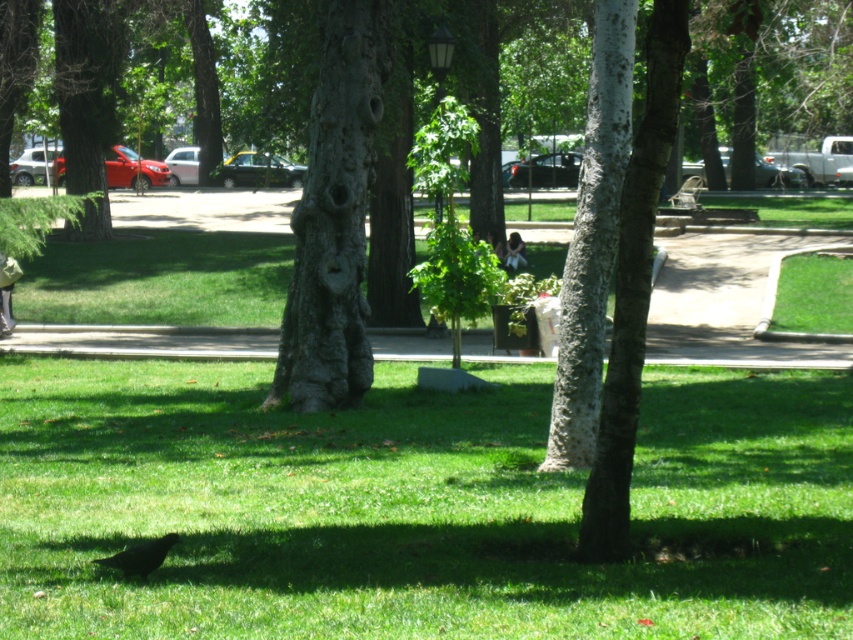
Question: Which of these objects is positioned closest to the rough bark tree at center?

Choices:
 (A) shiny black bird at lower left
 (B) metallic silver bench at center

Answer: (A)

Question: Which point is closer to the camera?

Choices:
 (A) (691, 196)
 (B) (142, 378)

Answer: (B)

Question: Which point is closer to the camera taking this photo?

Choices:
 (A) (753, 502)
 (B) (683, 202)

Answer: (A)

Question: Is rough bark tree at center thinner than metallic silver bench at center?

Choices:
 (A) no
 (B) yes

Answer: (B)

Question: Is white textured tree trunk at center thinner than shiny black bird at lower left?

Choices:
 (A) no
 (B) yes

Answer: (A)

Question: Can you confirm if rough bark tree at center is positioned to the right of metallic silver bench at center?

Choices:
 (A) yes
 (B) no

Answer: (B)